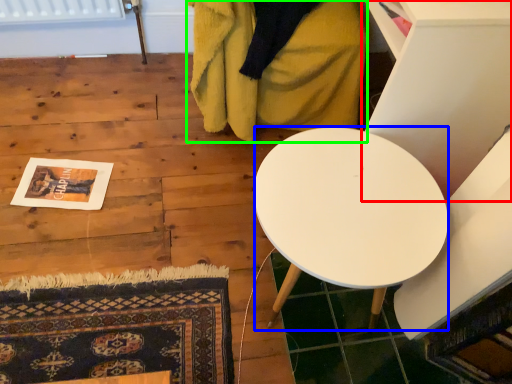
Question: Which object is the farthest from furniture (highlighted by a red box)? Choose among these: desk (highlighted by a blue box) or blanket (highlighted by a green box).

Choices:
 (A) desk
 (B) blanket

Answer: (B)